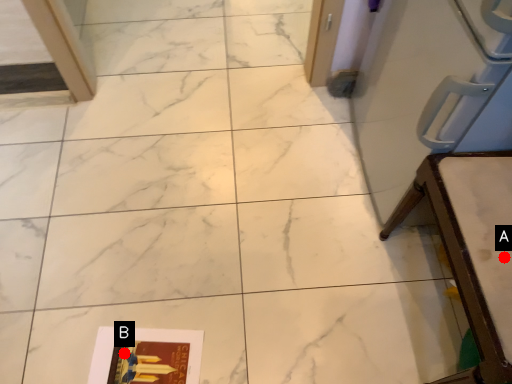
Question: Two points are circled on the image, labeled by A and B beside each circle. Which of the following is the farthest from the observer?

Choices:
 (A) A is further
 (B) B is further

Answer: (B)